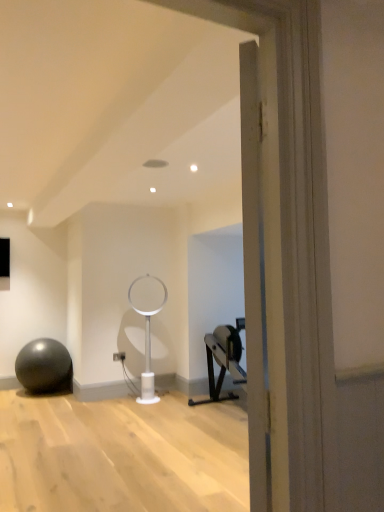
Question: Should I look upward or downward to see white plastic table lamp at center?

Choices:
 (A) down
 (B) up

Answer: (A)

Question: From the image's perspective, is white plastic table lamp at center located above matte gray ball at left?

Choices:
 (A) no
 (B) yes

Answer: (B)

Question: Does white plastic table lamp at center have a larger size compared to matte gray ball at left?

Choices:
 (A) no
 (B) yes

Answer: (A)

Question: Would you say matte gray ball at left is part of white plastic table lamp at center's contents?

Choices:
 (A) yes
 (B) no

Answer: (B)

Question: From a real-world perspective, is white plastic table lamp at center positioned over matte gray ball at left based on gravity?

Choices:
 (A) yes
 (B) no

Answer: (A)

Question: Is white plastic table lamp at center to the right of matte gray ball at left from the viewer's perspective?

Choices:
 (A) no
 (B) yes

Answer: (B)

Question: Can you confirm if white plastic table lamp at center is taller than matte gray ball at left?

Choices:
 (A) yes
 (B) no

Answer: (A)

Question: From a real-world perspective, is matte gray ball at left located higher than white plastic table lamp at center?

Choices:
 (A) no
 (B) yes

Answer: (A)

Question: Is matte gray ball at left placed right next to white plastic table lamp at center?

Choices:
 (A) no
 (B) yes

Answer: (A)

Question: Does matte gray ball at left lie in front of white plastic table lamp at center?

Choices:
 (A) no
 (B) yes

Answer: (A)

Question: Is matte gray ball at left turned away from white plastic table lamp at center?

Choices:
 (A) no
 (B) yes

Answer: (A)

Question: Can you confirm if matte gray ball at left is positioned to the right of white plastic table lamp at center?

Choices:
 (A) no
 (B) yes

Answer: (A)

Question: Could you tell me if matte gray ball at left is facing white plastic table lamp at center?

Choices:
 (A) no
 (B) yes

Answer: (A)

Question: Choose the correct answer: Is matte gray ball at left inside white plastic table lamp at center or outside it?

Choices:
 (A) outside
 (B) inside

Answer: (A)